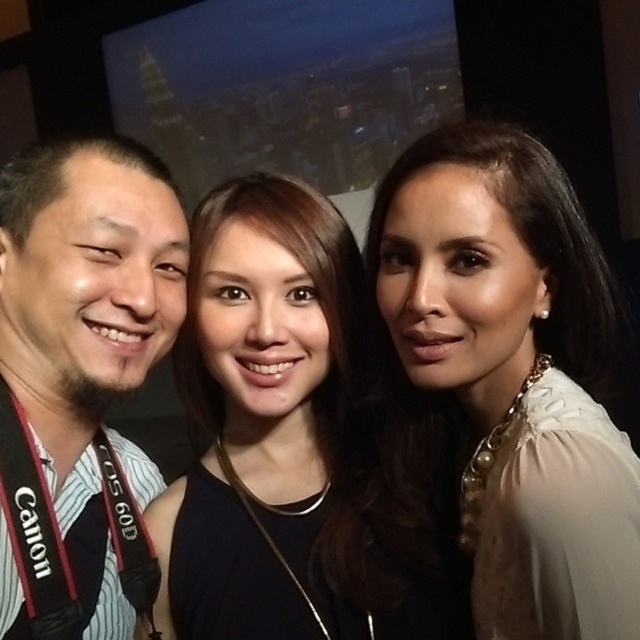
You are a photographer standing 2 meters away from the three people in the image. You want to take a closeup photo of the white pearl necklace at upper right. Can you capture it clearly without moving closer?

The three people are 55.40 centimeters apart, so the photographer can capture the white pearl necklace at upper right clearly without moving closer as they are within a reasonable distance for a closeup.

You are a photographer trying to adjust the lighting for a group photo. You notice the black fabric dress at center and the matte black shirt at left. Which one has a wider silhouette?

The black fabric dress at center has a wider silhouette than the matte black shirt at left, as its width surpasses the shirt.

You are a photographer trying to focus on the white pearl necklace at upper right. Where should you aim your camera lens to capture it?

You should aim your camera lens at point (513, 376) to capture the white pearl necklace at upper right.